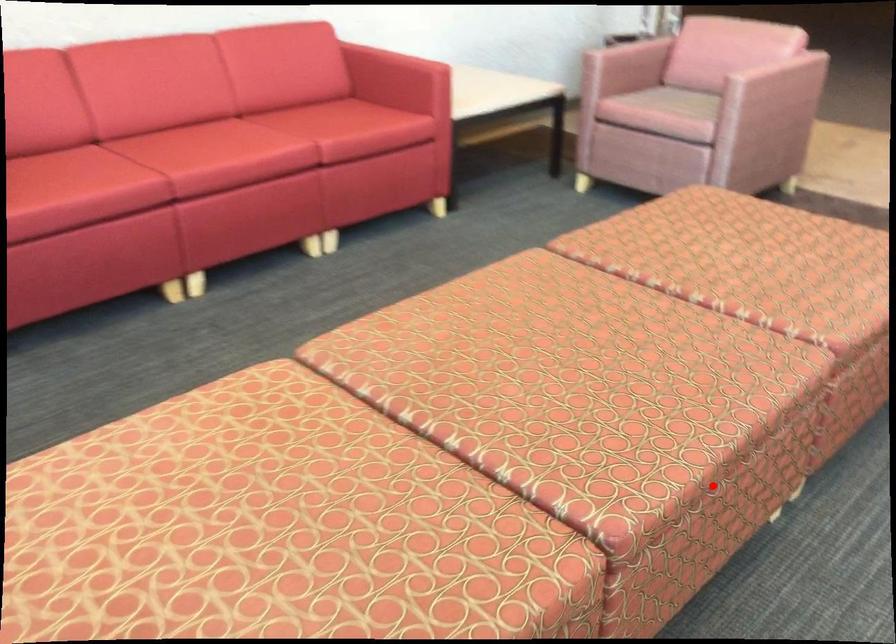
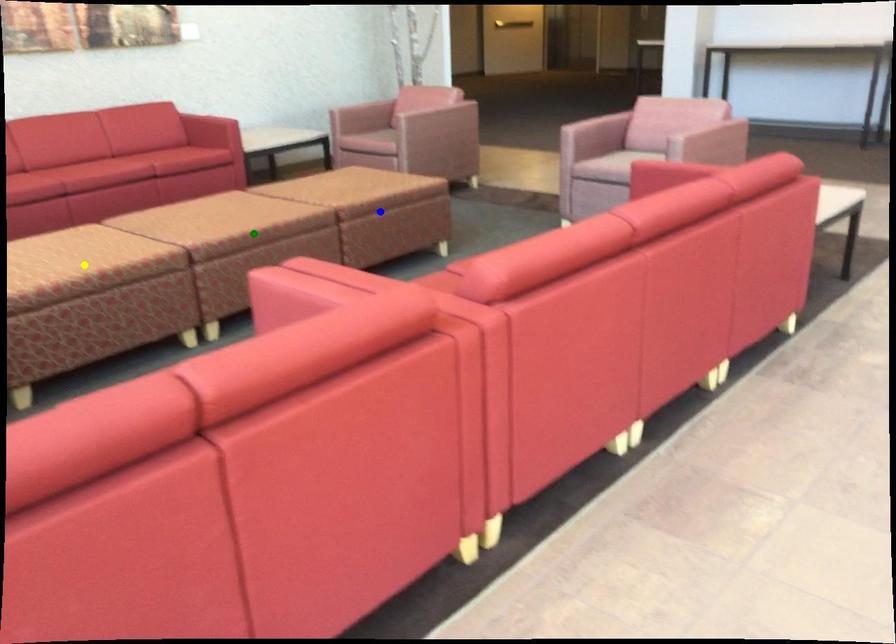
Question: I am providing you with two images of the same scene from different viewpoints. A red point is marked on the first image. You are given multiple points on the second image. In image 2, which mark is for the same physical point as the one in image 1?

Choices:
 (A) blue point
 (B) green point
 (C) yellow point

Answer: (B)